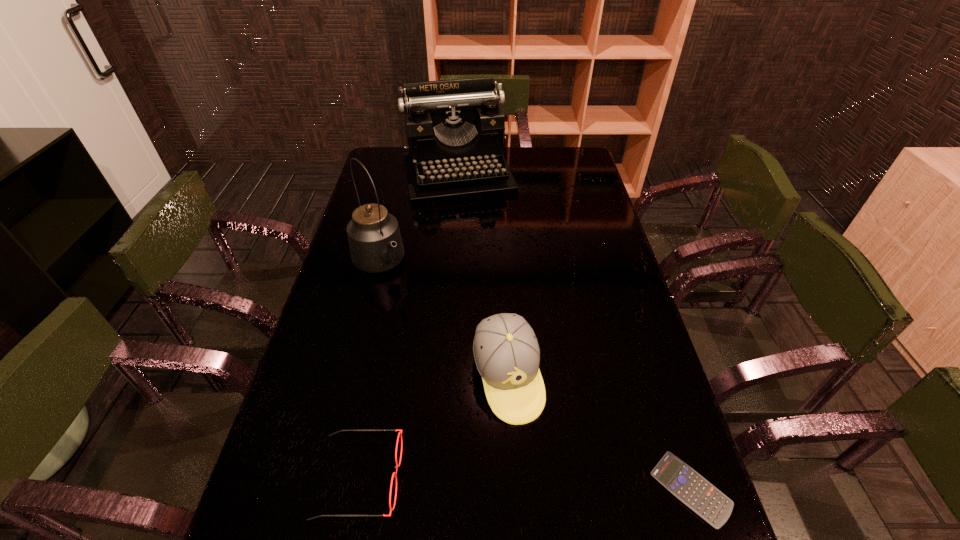
At what (x,y) coordinates should I click in order to perform the action: click on vacant space on the desktop that is between the spectacles and the rightmost object and is positioned on the front-facing side of the third farthest object. Please return your answer as a coordinate pair (x, y). The width and height of the screenshot is (960, 540). Looking at the image, I should click on (542, 484).

Where is `vacant space on the desktop that is between the fourth tallest object and the calculator and is positioned spout on the kettle`? This screenshot has width=960, height=540. vacant space on the desktop that is between the fourth tallest object and the calculator and is positioned spout on the kettle is located at coordinates (565, 484).

Locate an element on the screen. This screenshot has width=960, height=540. vacant space on the desktop that is between the spectacles and the shortest object and is positioned on the typing side of the typewriter is located at coordinates (552, 484).